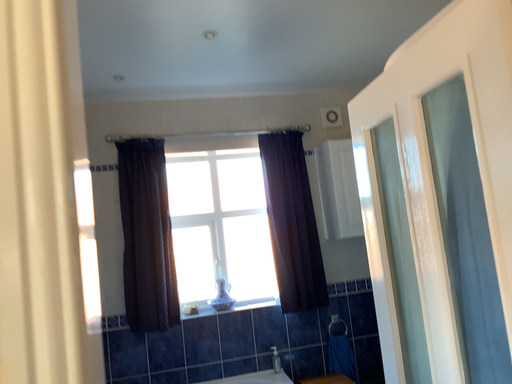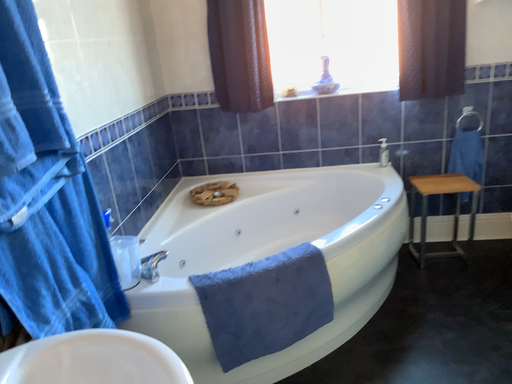
Question: How did the camera likely rotate when shooting the video?

Choices:
 (A) rotated right
 (B) rotated left

Answer: (B)